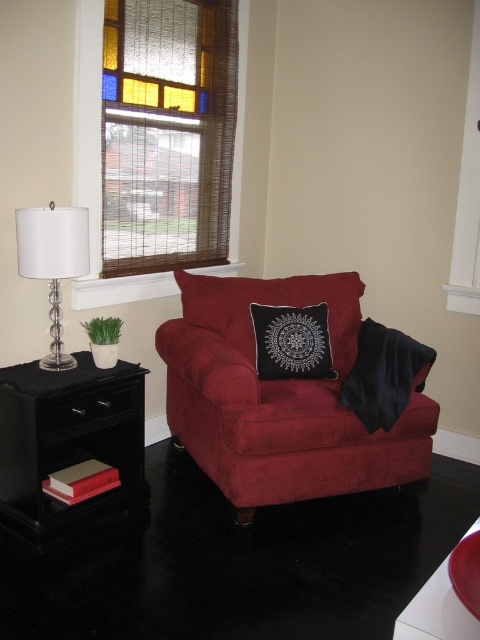
In the scene shown: You are standing in the room and want to place a 2.3 meters long sofa in a straight line from your current position. There is a point at coordinates point (328, 451). Can you safely place the sofa without it extending beyond the room?

The distance of point (328, 451) from the camera is 2.57 meters. Since the sofa is 2.3 meters long, placing it in a straight line from your current position up to that point would leave 0.27 meters of space remaining. Therefore, the sofa can be safely placed without extending beyond the room.

You are a delivery person who needs to place a package between the stained glass window at upper left and the red glossy bowl at lower right. The package requires a space of 6 feet. Can you fit it there?

The stained glass window at upper left is 6.58 feet away from the red glossy bowl at lower right. Since the required space is 6 feet, the package can be placed between them as the distance is sufficient.